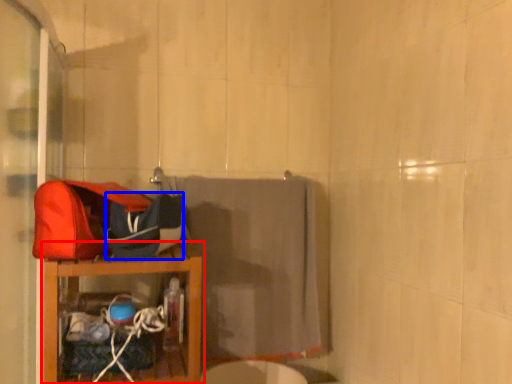
Question: Which point is further to the camera, furniture (highlighted by a red box) or kit (highlighted by a blue box)?

Choices:
 (A) furniture
 (B) kit

Answer: (B)